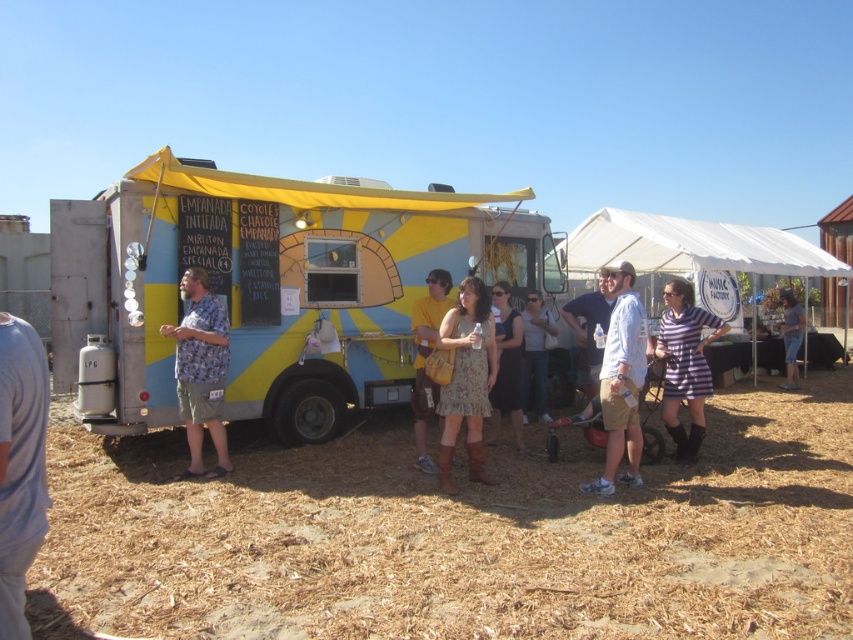
You are a customer waiting in line at the food truck. You notice the brown mulch at lower center and the white fabric canopy at upper right. Which object is closer to you as you stand in line?

The brown mulch at lower center is closer to you because it is in front of the white fabric canopy at upper right.